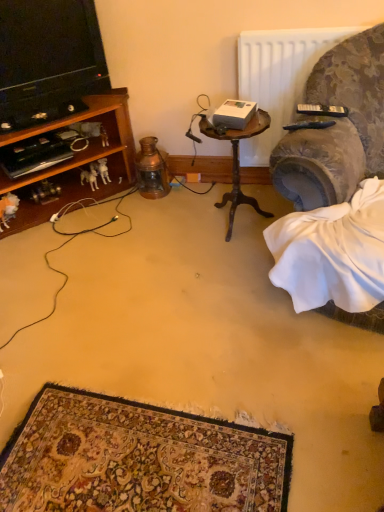
The width and height of the screenshot is (384, 512). In order to click on free spot in front of white plastic dog at lower left in this screenshot , I will do `click(91, 209)`.